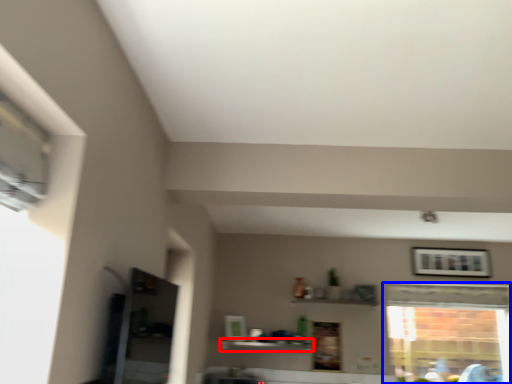
Question: Among these objects, which one is farthest to the camera, shelf (highlighted by a red box) or window (highlighted by a blue box)?

Choices:
 (A) shelf
 (B) window

Answer: (B)